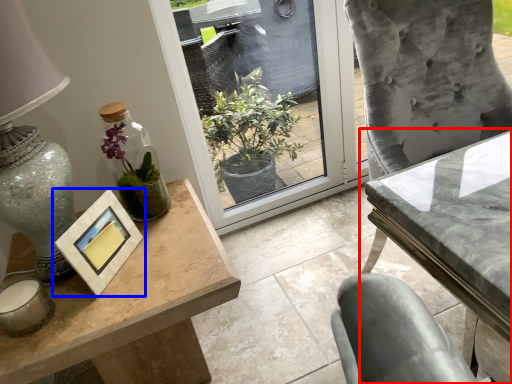
Question: Which object appears closest to the camera in this image, table (highlighted by a red box) or picture frame (highlighted by a blue box)?

Choices:
 (A) table
 (B) picture frame

Answer: (A)